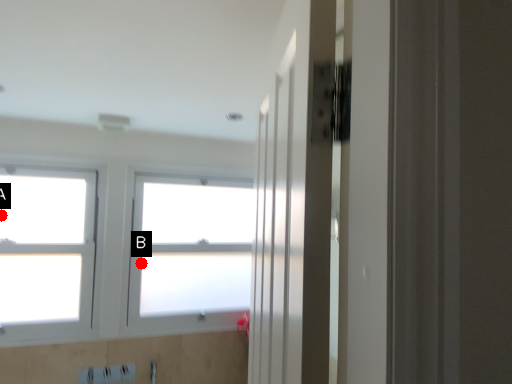
Question: Two points are circled on the image, labeled by A and B beside each circle. Which point is farther to the camera?

Choices:
 (A) A is further
 (B) B is further

Answer: (B)